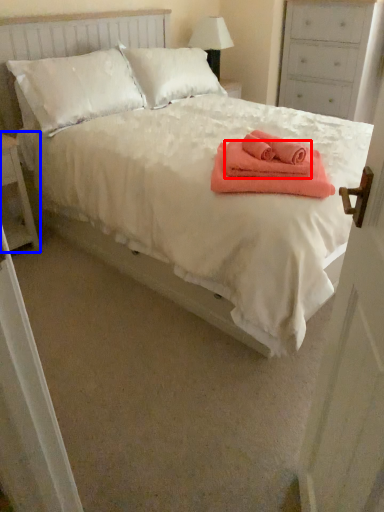
Question: Which object is closer to the camera taking this photo, cloth (highlighted by a red box) or nightstand (highlighted by a blue box)?

Choices:
 (A) cloth
 (B) nightstand

Answer: (A)